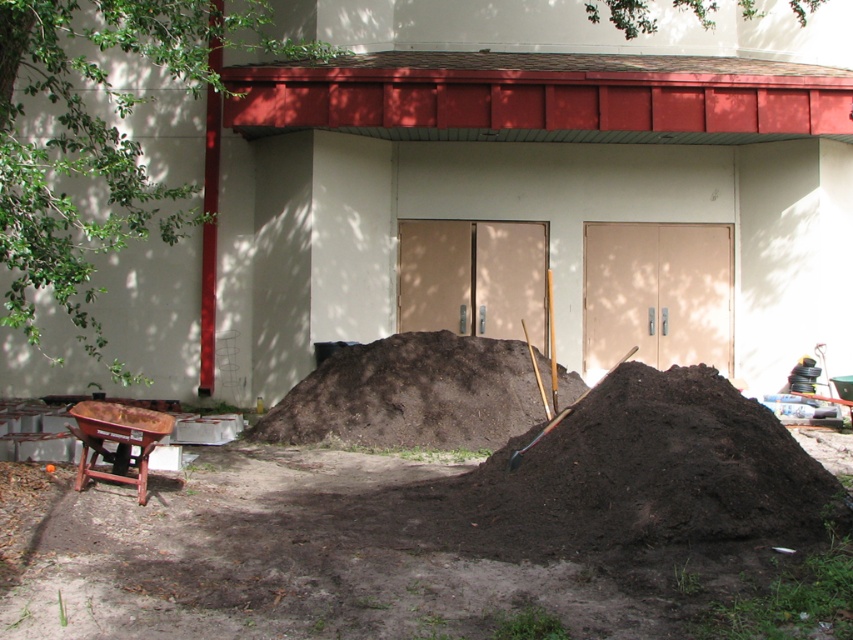
Question: Which point is farther to the camera?

Choices:
 (A) dark brown soil at center
 (B) metallic silver shovel at center

Answer: (A)

Question: Observing the image, what is the correct spatial positioning of dark brown soil at center in reference to metallic silver shovel at center?

Choices:
 (A) below
 (B) above

Answer: (A)

Question: Among these objects, which one is farthest from the camera?

Choices:
 (A) dark brown soil at center
 (B) metallic silver shovel at center

Answer: (A)

Question: Does dark brown soil at center appear on the right side of metallic silver shovel at center?

Choices:
 (A) yes
 (B) no

Answer: (B)

Question: Which object appears closest to the camera in this image?

Choices:
 (A) dark brown soil at center
 (B) metallic silver shovel at center

Answer: (B)

Question: Does dark brown soil at center appear over metallic silver shovel at center?

Choices:
 (A) no
 (B) yes

Answer: (A)